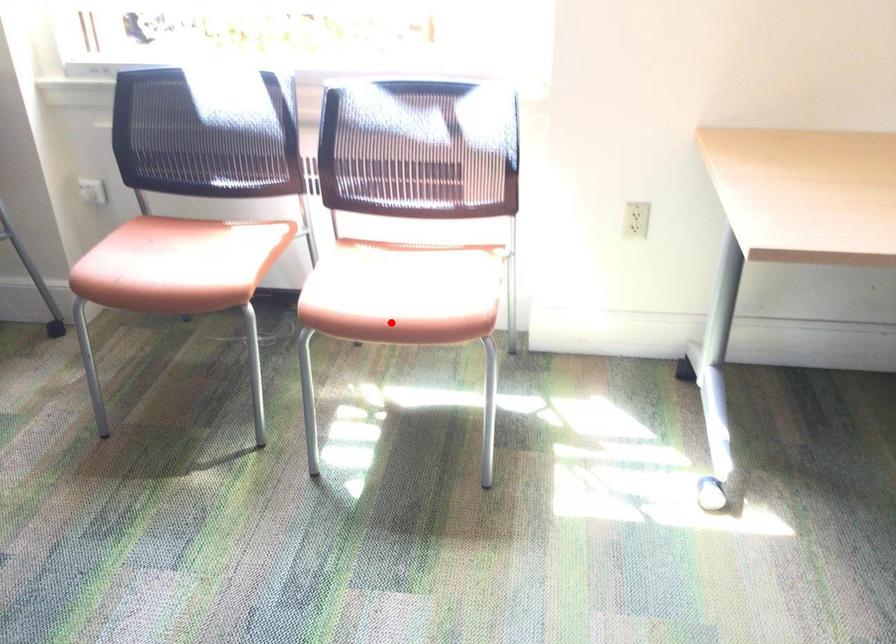
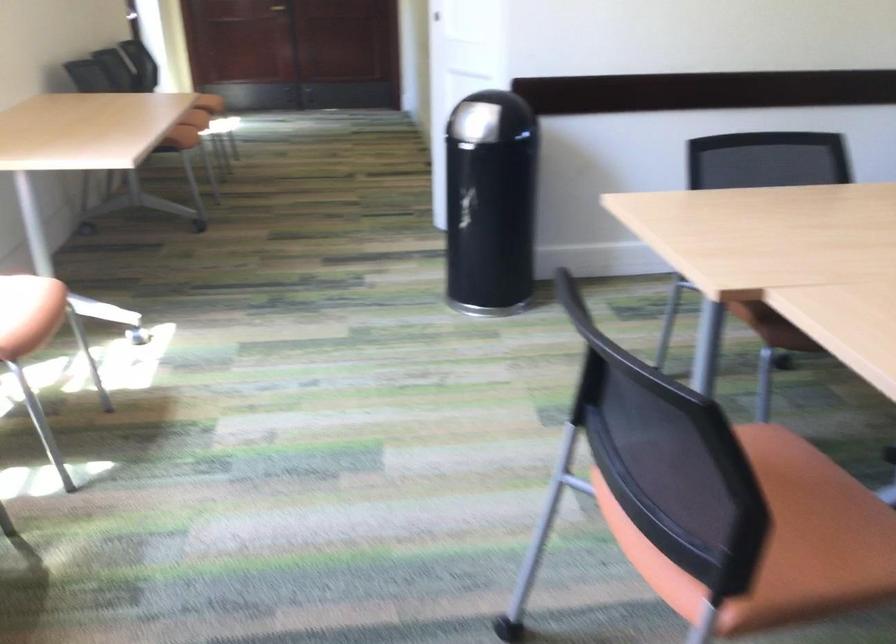
Question: I am providing you with two images of the same scene from different viewpoints. Image1 has a red point marked. In image2, the corresponding 3D location appears at what relative position? Reply with the corresponding letter.

Choices:
 (A) Closer
 (B) Farther

Answer: (B)